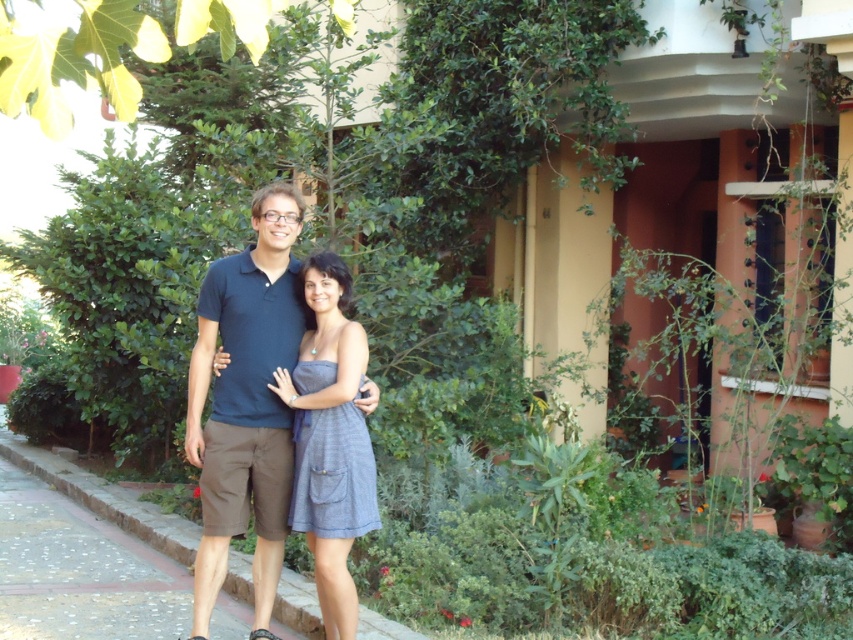
You are a photographer setting up for a group photo. You have two subjects wearing the dark blue cotton shirt at center and the gray woven dress at center. You want to ensure both are visible in the frame. Which subject should you position closer to the front to avoid the taller one blocking the shorter one?

The dark blue cotton shirt at center is much taller than the gray woven dress at center. Therefore, you should position the gray woven dress at center closer to the front to avoid being blocked by the taller subject.

You are standing in front of the building and see the point marked at coordinates (247, 403). What object is located at that point?

The point at coordinates (247, 403) marks the dark blue cotton shirt at center.